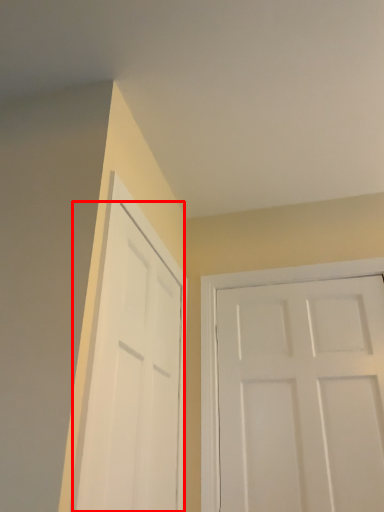
Question: From the image's perspective, what is the correct spatial positioning of door (annotated by the red box) in reference to door?

Choices:
 (A) below
 (B) above

Answer: (B)